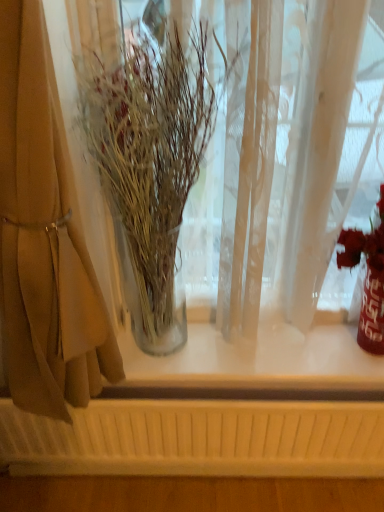
Question: From a real-world perspective, is clear glass vase at left physically below shiny metallic vase at right?

Choices:
 (A) yes
 (B) no

Answer: (B)

Question: Is clear glass vase at left at the left side of shiny metallic vase at right?

Choices:
 (A) no
 (B) yes

Answer: (B)

Question: Is clear glass vase at left positioned with its back to shiny metallic vase at right?

Choices:
 (A) yes
 (B) no

Answer: (B)

Question: Can you confirm if clear glass vase at left is bigger than shiny metallic vase at right?

Choices:
 (A) no
 (B) yes

Answer: (B)

Question: From the image's perspective, does clear glass vase at left appear lower than shiny metallic vase at right?

Choices:
 (A) yes
 (B) no

Answer: (B)

Question: Is clear glass vase at left far from shiny metallic vase at right?

Choices:
 (A) yes
 (B) no

Answer: (B)

Question: Does clear glass vase at left have a larger size compared to beige fabric curtain at left?

Choices:
 (A) yes
 (B) no

Answer: (B)

Question: Can you confirm if clear glass vase at left is wider than beige fabric curtain at left?

Choices:
 (A) yes
 (B) no

Answer: (B)

Question: From a real-world perspective, is clear glass vase at left located higher than beige fabric curtain at left?

Choices:
 (A) yes
 (B) no

Answer: (B)

Question: From a real-world perspective, does clear glass vase at left sit lower than beige fabric curtain at left?

Choices:
 (A) no
 (B) yes

Answer: (B)

Question: Is clear glass vase at left smaller than beige fabric curtain at left?

Choices:
 (A) yes
 (B) no

Answer: (A)

Question: Does clear glass vase at left lie behind beige fabric curtain at left?

Choices:
 (A) no
 (B) yes

Answer: (B)

Question: Considering the relative sizes of shiny metallic vase at right and clear glass vase at left in the image provided, is shiny metallic vase at right bigger than clear glass vase at left?

Choices:
 (A) yes
 (B) no

Answer: (B)